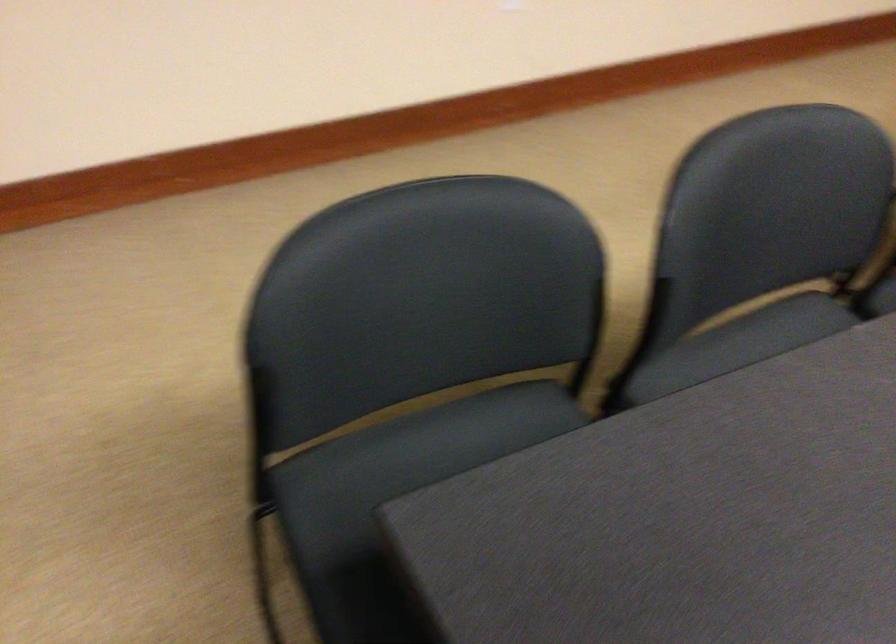
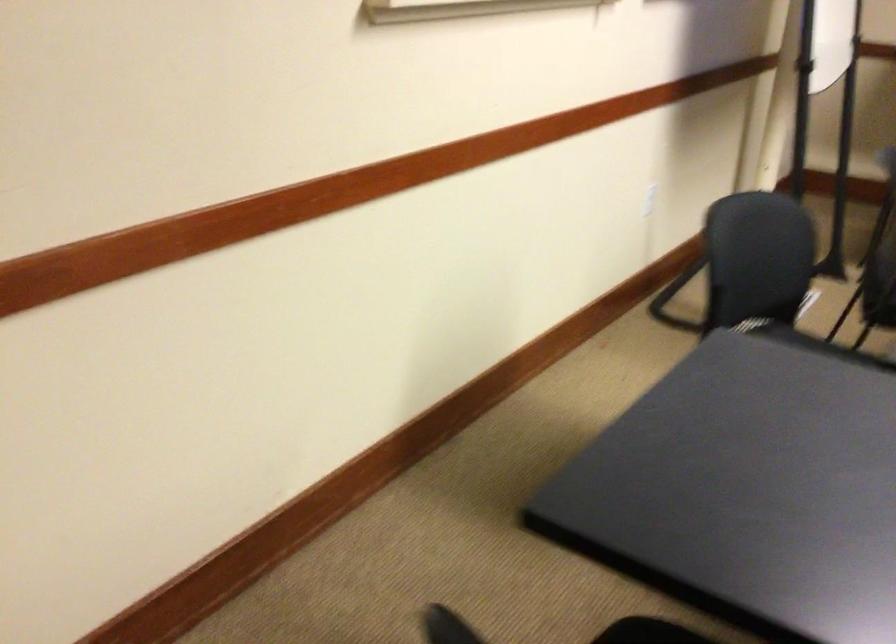
The images are taken continuously from a first-person perspective. In which direction is your viewpoint rotating?

The rotation direction of the camera is right-down.